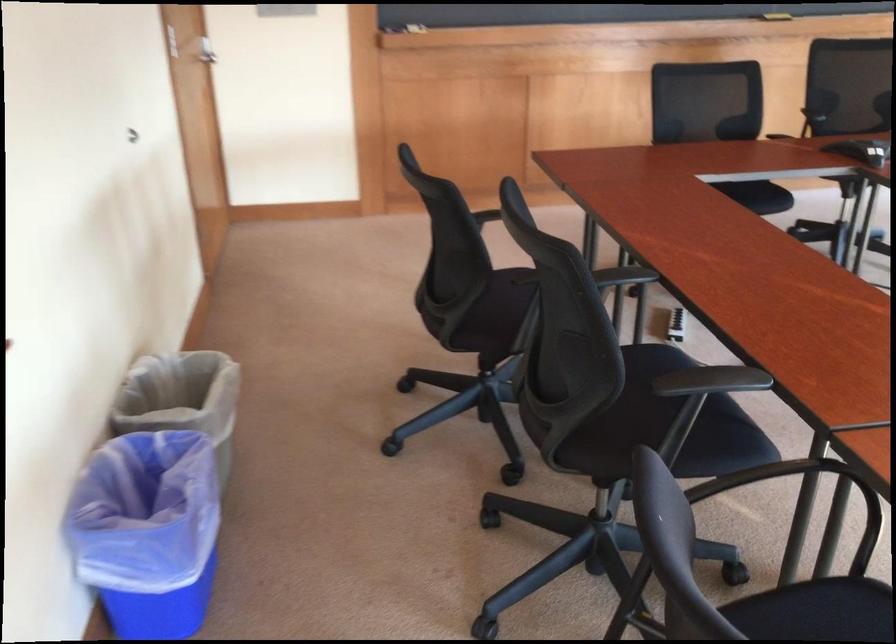
Which object does [182,399] point to?

It refers to a grey trash can.